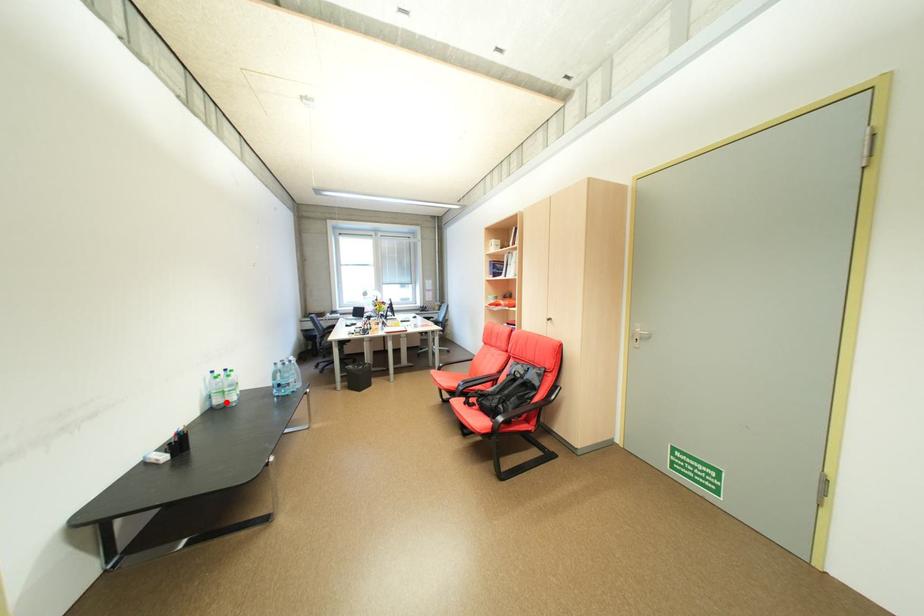
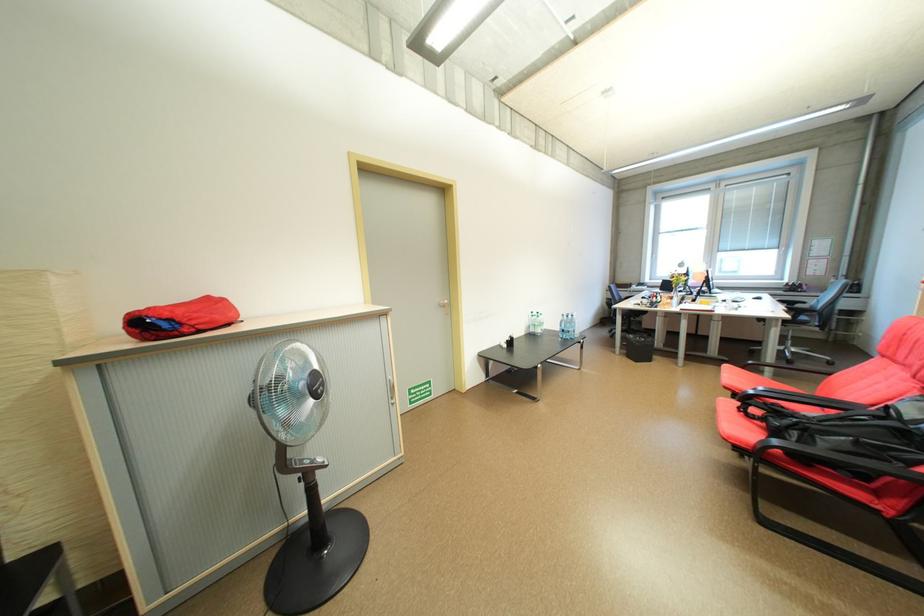
Question: I am providing you with two images of the same scene from different viewpoints. In image1, a red point is highlighted. Considering the same 3D point in image2, which of the following is correct?

Choices:
 (A) It is closer
 (B) It is farther

Answer: (B)